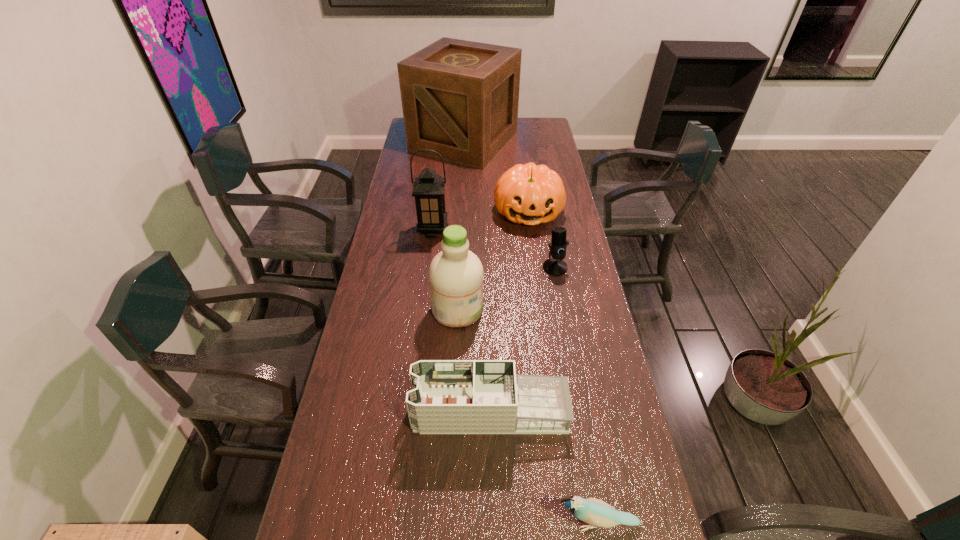
Find the location of a particular element. free space located 0.210m on the front label of the cleansing agent is located at coordinates (547, 309).

You are a GUI agent. You are given a task and a screenshot of the screen. Output one action in this format:
    pyautogui.click(x=<x>, y=<y>)
    Task: Click on the vacant region located on the carved face of the fourth shortest object
    The width and height of the screenshot is (960, 540).
    Given the screenshot: What is the action you would take?
    pyautogui.click(x=533, y=243)

This screenshot has width=960, height=540. What are the coordinates of `free space located 0.340m on the stand of the microphone` in the screenshot? It's located at (570, 355).

Where is `vacant space located at the entrance of the sixth farthest object`? vacant space located at the entrance of the sixth farthest object is located at coordinates (339, 411).

Identify the location of vacant space located at the entrance of the sixth farthest object. (372, 411).

Find the location of a particular element. free space located at the entrance of the sixth farthest object is located at coordinates (362, 411).

Locate an element on the screen. This screenshot has width=960, height=540. vacant area situated 0.060m at the face of the bird is located at coordinates (527, 523).

Where is `vacant space situated at the face of the bird`? vacant space situated at the face of the bird is located at coordinates [384, 523].

At what (x,y) coordinates should I click in order to perform the action: click on free spot located at the face of the bird. Please return your answer as a coordinate pair (x, y). Image resolution: width=960 pixels, height=540 pixels. Looking at the image, I should click on (420, 523).

Identify the location of object that is at the far edge. The height and width of the screenshot is (540, 960). (460, 98).